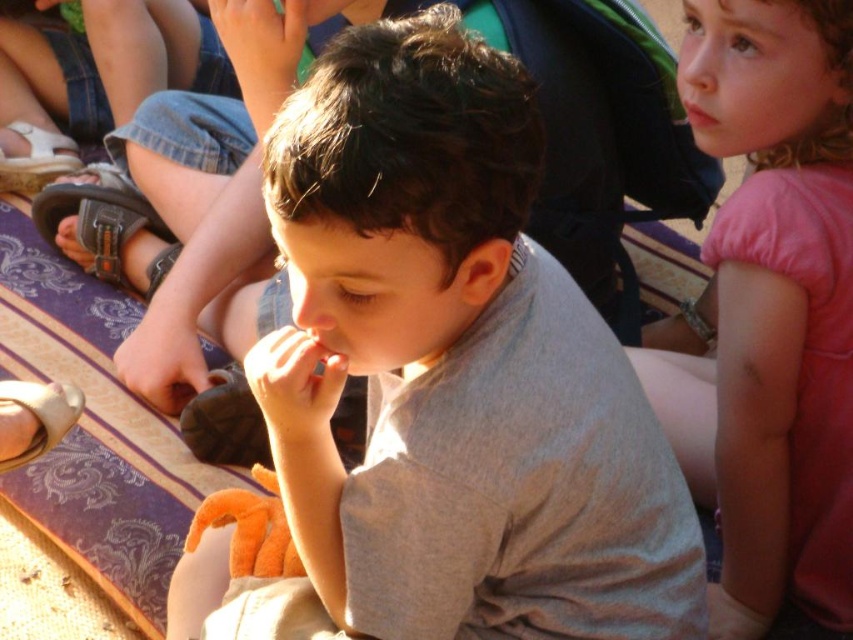
You are a photographer trying to capture a candid shot of the pink cotton shirt at upper right and the brown leather sandal at lower left. Which object should you adjust your camera angle to focus on first if you want to start with the one closer to the ground?

The brown leather sandal at lower left is closer to the ground compared to the pink cotton shirt at upper right, so you should focus on the brown leather sandal at lower left first.

You are a photographer standing 1 meter away from the gray cotton shirt at center. Can you adjust your position to get a closer shot without moving the shirt?

The gray cotton shirt at center is 88.88 centimeters away from the camera. Since you are currently 1 meter away, you can move closer by 11.12 centimeters to achieve a closer shot without moving the shirt.

You are a tailor who needs to determine which item has a greater width between the gray cotton shirt at center and the leather sandal at lower left. Based on the scene, which one should you choose?

The gray cotton shirt at center has a greater width than the leather sandal at lower left according to the description.